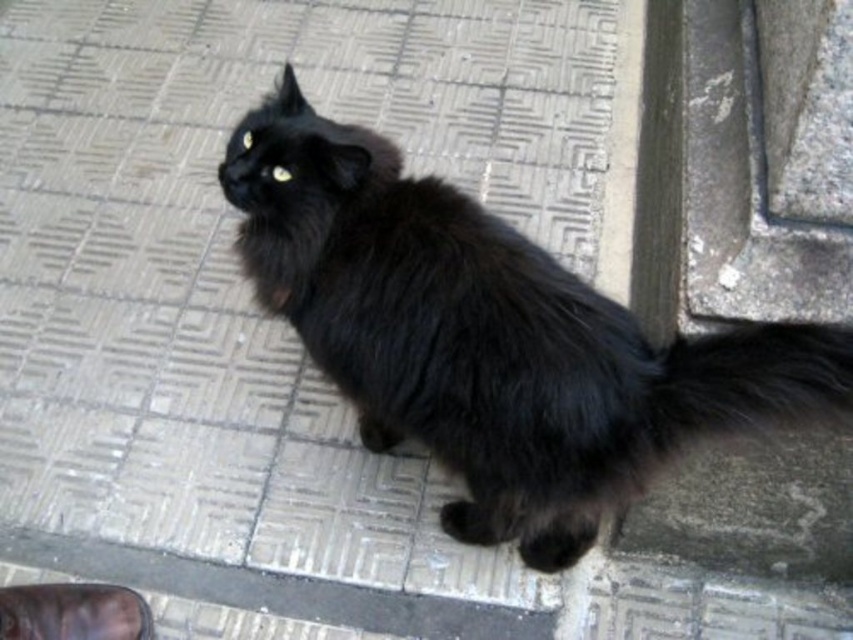
You are a photographer trying to capture the black fluffy cat at center and the black fluffy tail at lower right in a single frame. Based on their positions and sizes, can you fit both subjects into the camera view without moving the camera?

The black fluffy cat at center might be wider than black fluffy tail at lower right, so there is a possibility that both can fit into the camera view if the camera angle is adjusted properly to accommodate their widths.

Where is the black fluffy cat at center located in the image?

The black fluffy cat at center is located at point (x=489, y=337) in the image.